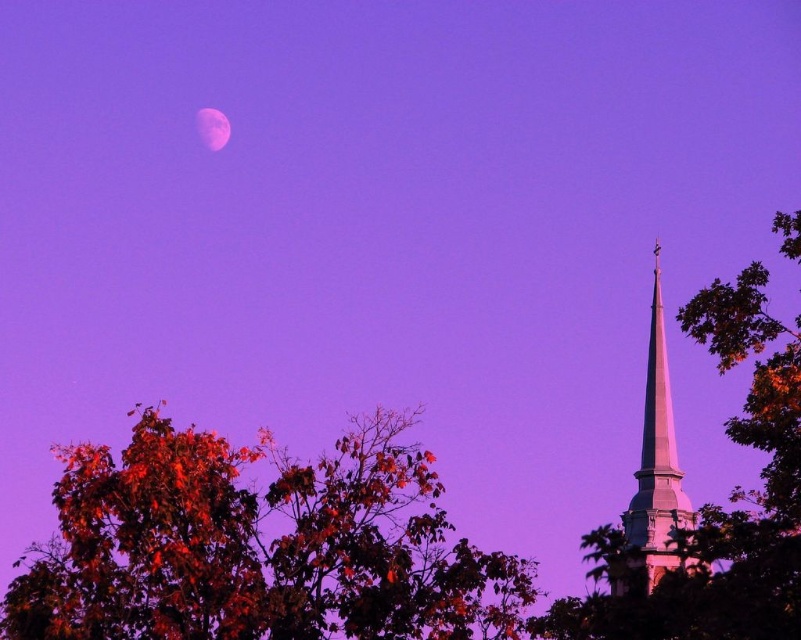
Is reddish-brown foliage at lower left shorter than smooth brown tree at right?

Yes, reddish-brown foliage at lower left is shorter than smooth brown tree at right.

Consider the image. Does reddish-brown foliage at lower left appear on the left side of smooth brown tree at right?

Yes, reddish-brown foliage at lower left is to the left of smooth brown tree at right.

Measure the distance between reddish-brown foliage at lower left and camera.

A distance of 163.14 meters exists between reddish-brown foliage at lower left and camera.

You are a GUI agent. You are given a task and a screenshot of the screen. Output one action in this format:
    pyautogui.click(x=<x>, y=<y>)
    Task: Click on the reddish-brown foliage at lower left
    The image size is (801, 640).
    Given the screenshot: What is the action you would take?
    pyautogui.click(x=258, y=547)

Between reddish-brown foliage at lower left and white smooth steeple at upper right, which one appears on the right side from the viewer's perspective?

white smooth steeple at upper right

Is point (164, 435) positioned after point (654, 467)?

That is False.

Who is more distant from viewer, (369, 513) or (650, 522)?

The point (369, 513) is behind.

Where is `reddish-brown foliage at lower left`? This screenshot has width=801, height=640. reddish-brown foliage at lower left is located at coordinates (258, 547).

Between reddish-brown foliage at lower left and pink translucent moon at upper center, which one has more height?

reddish-brown foliage at lower left is taller.

Is reddish-brown foliage at lower left shorter than pink translucent moon at upper center?

No.

Is point (296, 595) behind point (207, 147)?

No, (296, 595) is closer to viewer.

The image size is (801, 640). I want to click on reddish-brown foliage at lower left, so click(258, 547).